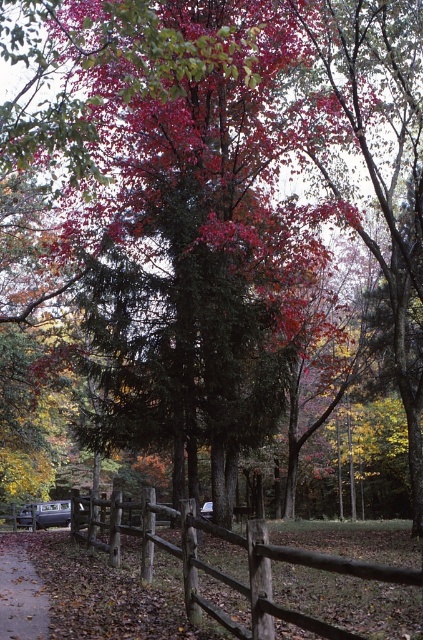
Is brown wooden fence at lower center to the right of metallic silver car at lower left from the viewer's perspective?

Indeed, brown wooden fence at lower center is positioned on the right side of metallic silver car at lower left.

Is the position of brown wooden fence at lower center more distant than that of metallic silver car at lower left?

That is False.

Describe the element at coordinates (225, 572) in the screenshot. I see `brown wooden fence at lower center` at that location.

Where is `brown wooden fence at lower center`? Image resolution: width=423 pixels, height=640 pixels. brown wooden fence at lower center is located at coordinates (225, 572).

Does brown wooden path at lower left have a greater width compared to metallic silver car at lower left?

Incorrect, brown wooden path at lower left's width does not surpass metallic silver car at lower left's.

Does brown wooden path at lower left come behind metallic silver car at lower left?

No, brown wooden path at lower left is in front of metallic silver car at lower left.

Identify the location of brown wooden path at lower left. This screenshot has width=423, height=640. (21, 593).

At what (x,y) coordinates should I click in order to perform the action: click on brown wooden path at lower left. Please return your answer as a coordinate pair (x, y). Image resolution: width=423 pixels, height=640 pixels. Looking at the image, I should click on (21, 593).

Is brown wooden fence at lower center behind brown wooden path at lower left?

No, brown wooden fence at lower center is in front of brown wooden path at lower left.

The height and width of the screenshot is (640, 423). Find the location of `brown wooden fence at lower center`. brown wooden fence at lower center is located at coordinates (225, 572).

Locate an element on the screen. This screenshot has width=423, height=640. brown wooden fence at lower center is located at coordinates (225, 572).